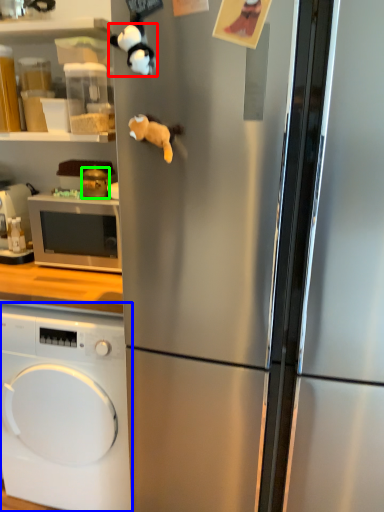
Question: Which is farther away from animal (highlighted by a red box)? washing machine (highlighted by a blue box) or appliance (highlighted by a green box)?

Choices:
 (A) washing machine
 (B) appliance

Answer: (A)